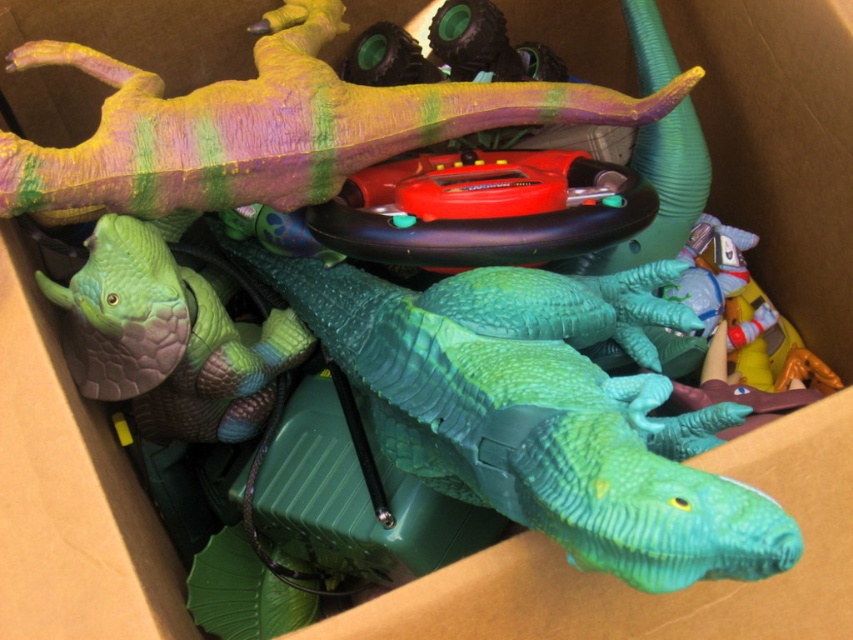
The image size is (853, 640). Describe the element at coordinates (537, 422) in the screenshot. I see `green plastic dinosaur at center` at that location.

You are a GUI agent. You are given a task and a screenshot of the screen. Output one action in this format:
    pyautogui.click(x=<x>, y=<y>)
    Task: Click on the green plastic dinosaur at center
    The height and width of the screenshot is (640, 853).
    Given the screenshot: What is the action you would take?
    pyautogui.click(x=537, y=422)

Identify the location of green plastic dinosaur at center. (537, 422).